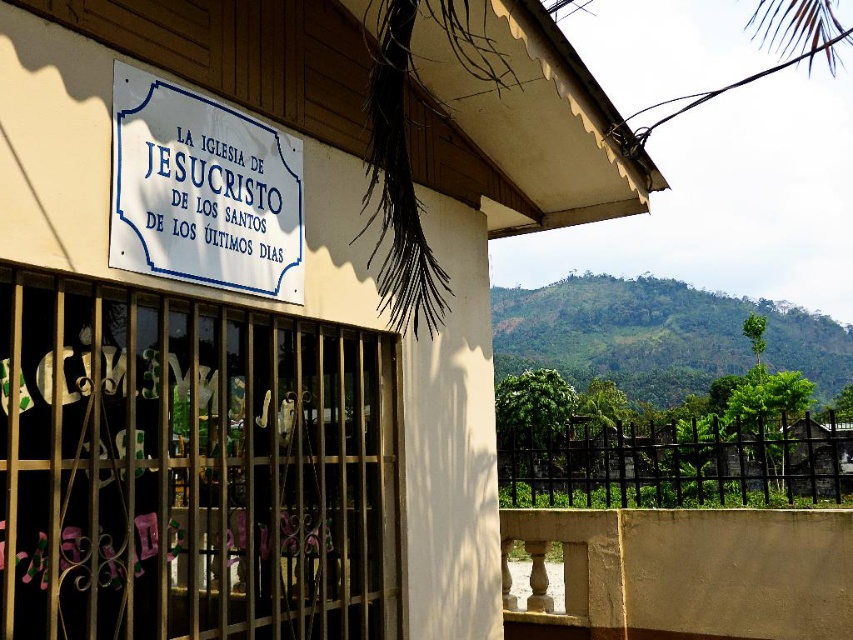
You are standing in front of the building and want to see the white matte sign at upper center. Is the sign visible from the position where the black metal fence at lower right is located?

The white matte sign at upper center is above the black metal fence at lower right, so it should be visible from the position where the black metal fence at lower right is located.

You are standing in front of the church and need to read the white paper sign at upper center. However, there is a black metal fence at lower right nearby. Will the fence block your view of the sign?

The white paper sign at upper center is not as tall as the black metal fence at lower right, so the fence may block your view of the sign depending on their positions.